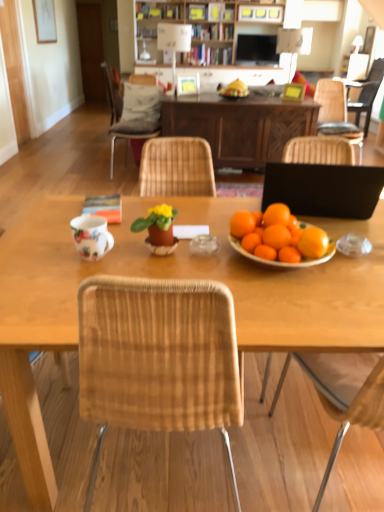
I want to click on free spot to the right of floral ceramic mug at center, so click(x=150, y=263).